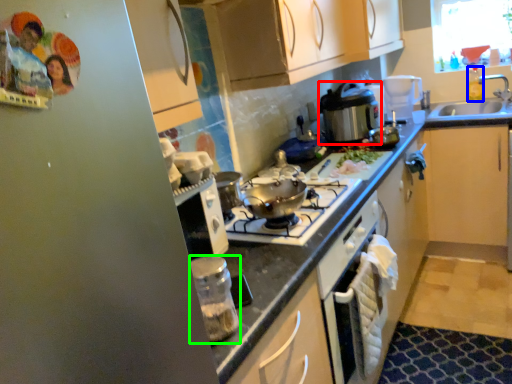
Question: Which object is positioned closest to kitchen appliance (highlighted by a red box)? Select from bottle (highlighted by a blue box) and kitchen appliance (highlighted by a green box).

Choices:
 (A) bottle
 (B) kitchen appliance

Answer: (A)